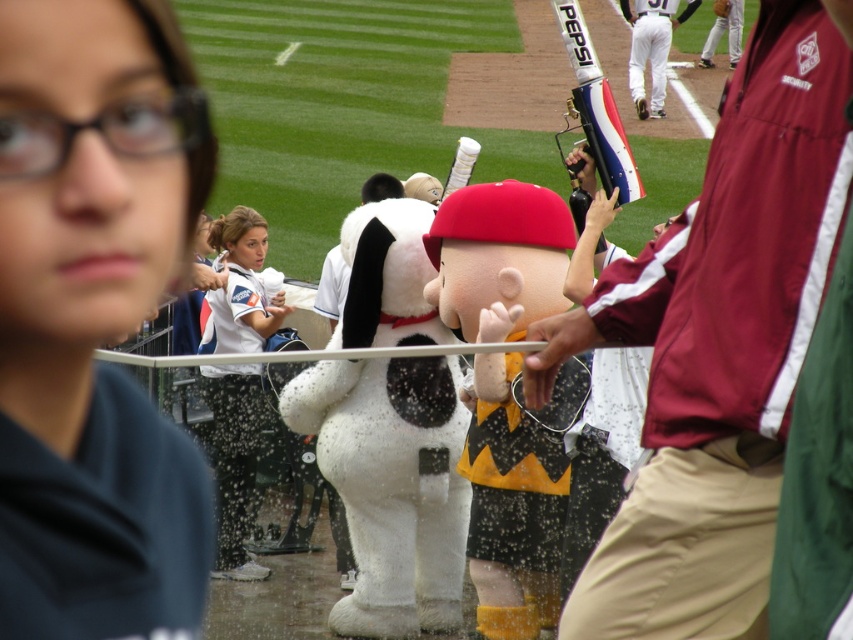
Question: Among these objects, which one is farthest from the camera?

Choices:
 (A) white plush dog at center
 (B) dark blue shirt at upper left
 (C) white fabric shirt at center
 (D) maroon security jacket at center

Answer: (A)

Question: Does dark blue shirt at upper left lie in front of white fabric shirt at center?

Choices:
 (A) yes
 (B) no

Answer: (A)

Question: Which object is farther from the camera taking this photo?

Choices:
 (A) white plush dog at center
 (B) maroon security jacket at center
 (C) white fabric shirt at center

Answer: (A)

Question: Considering the relative positions of white plush dog at center and white fabric shirt at center in the image provided, where is white plush dog at center located with respect to white fabric shirt at center?

Choices:
 (A) right
 (B) left

Answer: (A)

Question: Is dark blue shirt at upper left bigger than white fabric shirt at center?

Choices:
 (A) yes
 (B) no

Answer: (B)

Question: Which point is farther to the camera?

Choices:
 (A) (402, 269)
 (B) (706, 531)
 (C) (129, 326)

Answer: (A)